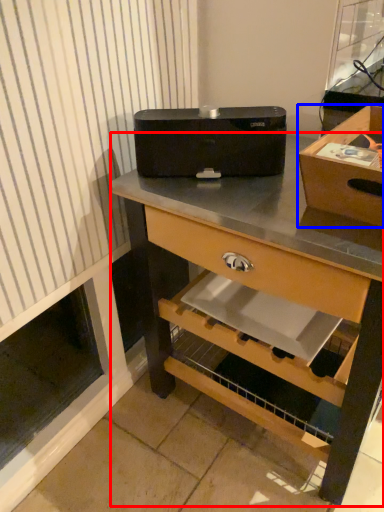
Question: Which object appears farthest to the camera in this image, desk (highlighted by a red box) or box (highlighted by a blue box)?

Choices:
 (A) desk
 (B) box

Answer: (B)